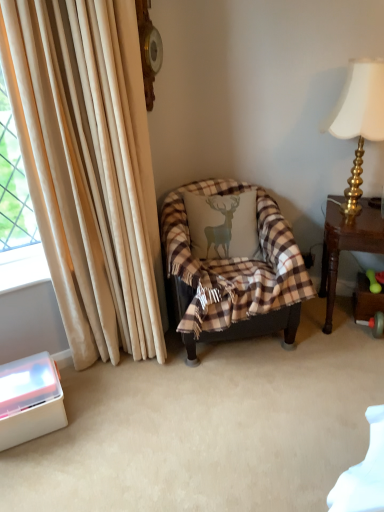
Question: From a real-world perspective, is plaid fabric pillow with deer design at center physically located above or below plaid fabric chair at center?

Choices:
 (A) above
 (B) below

Answer: (A)

Question: Choose the correct answer: Is plaid fabric pillow with deer design at center inside plaid fabric chair at center or outside it?

Choices:
 (A) inside
 (B) outside

Answer: (A)

Question: Which of these objects is positioned closest to the white plastic container at lower left?

Choices:
 (A) plaid fabric pillow with deer design at center
 (B) plaid fabric chair at center
 (C) brown wooden table at right
 (D) beige velvet curtain at left
 (E) gold metallic lampshade at upper right

Answer: (D)

Question: Which is nearer to the brown wooden table at right?

Choices:
 (A) plaid fabric chair at center
 (B) plaid fabric pillow with deer design at center
 (C) gold metallic lampshade at upper right
 (D) white plastic container at lower left
 (E) beige velvet curtain at left

Answer: (C)